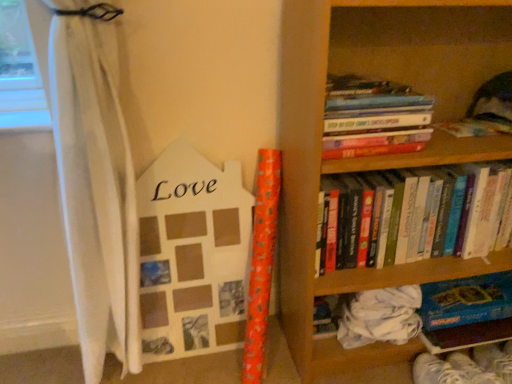
Question: Should I look upward or downward to see hardcover books at upper right, arranged as the 3th book when ordered from the bottom?

Choices:
 (A) up
 (B) down

Answer: (A)

Question: Is the depth of wooden bookcase at right less than that of hardcover books at upper right, positioned as the 2th book in bottom-to-top order?

Choices:
 (A) no
 (B) yes

Answer: (B)

Question: Does wooden bookcase at right have a lesser width compared to hardcover books at upper right, which is the second book in top-to-bottom order?

Choices:
 (A) yes
 (B) no

Answer: (B)

Question: From a real-world perspective, is wooden bookcase at right on top of hardcover books at upper right, which is the second book in top-to-bottom order?

Choices:
 (A) no
 (B) yes

Answer: (B)

Question: Considering the relative sizes of wooden bookcase at right and hardcover books at upper right, which is the second book in top-to-bottom order, in the image provided, is wooden bookcase at right smaller than hardcover books at upper right, which is the second book in top-to-bottom order,?

Choices:
 (A) no
 (B) yes

Answer: (A)

Question: Does wooden bookcase at right have a greater height compared to hardcover books at upper right, positioned as the 2th book in bottom-to-top order?

Choices:
 (A) no
 (B) yes

Answer: (B)

Question: From the image's perspective, is wooden bookcase at right under hardcover books at upper right, positioned as the 2th book in bottom-to-top order?

Choices:
 (A) no
 (B) yes

Answer: (A)

Question: From a real-world perspective, is wooden bookcase at right located beneath hardcover books at upper right, which is counted as the first book, starting from the top?

Choices:
 (A) no
 (B) yes

Answer: (B)

Question: Is wooden bookcase at right directly adjacent to hardcover books at upper right, which is counted as the first book, starting from the top?

Choices:
 (A) no
 (B) yes

Answer: (A)

Question: Does wooden bookcase at right have a lesser width compared to hardcover books at upper right, which is counted as the first book, starting from the top?

Choices:
 (A) yes
 (B) no

Answer: (B)

Question: Is wooden bookcase at right not close to hardcover books at upper right, which is counted as the first book, starting from the top?

Choices:
 (A) yes
 (B) no

Answer: (B)

Question: From the image's perspective, does wooden bookcase at right appear lower than hardcover books at upper right, arranged as the 3th book when ordered from the bottom?

Choices:
 (A) yes
 (B) no

Answer: (A)

Question: Does wooden bookcase at right contain hardcover books at upper right, which is counted as the first book, starting from the top?

Choices:
 (A) no
 (B) yes

Answer: (B)

Question: Is hardcover books at upper right, positioned as the 2th book in bottom-to-top order, wider than wooden photo frame at left?

Choices:
 (A) no
 (B) yes

Answer: (B)